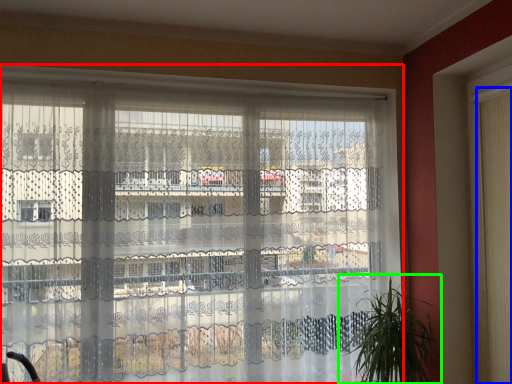
Question: Estimate the real-world distances between objects in this image. Which object is farther from window (highlighted by a red box), shutter (highlighted by a blue box) or houseplant (highlighted by a green box)?

Choices:
 (A) shutter
 (B) houseplant

Answer: (A)